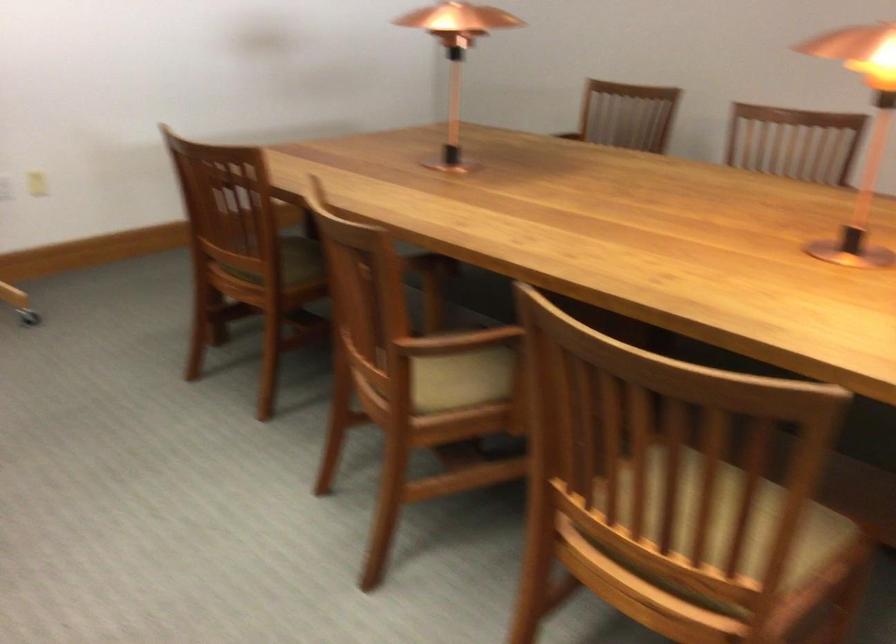
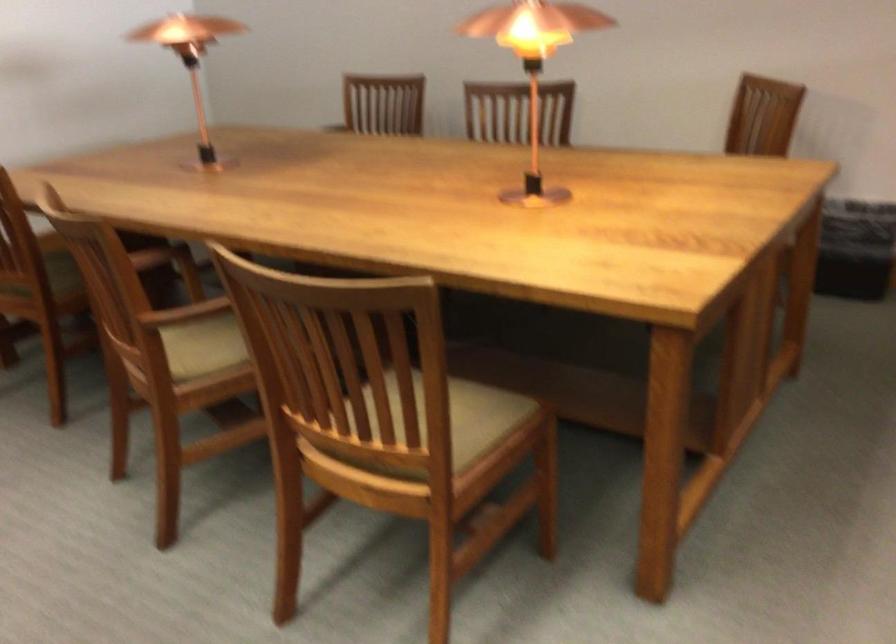
Question: The camera is either moving clockwise (left) or counter-clockwise (right) around the object. The first image is from the beginning of the video and the second image is from the end. Is the camera moving left or right when shooting the video?

Choices:
 (A) Left
 (B) Right

Answer: (A)